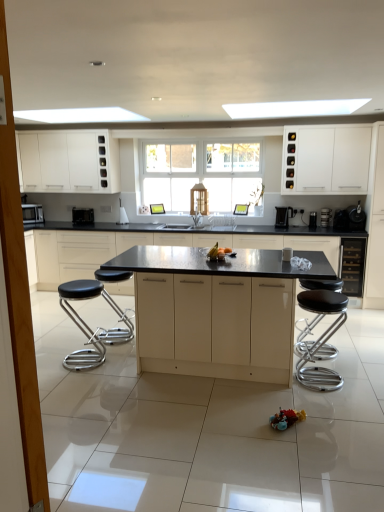
Question: From a real-world perspective, is matte black countertop at center, the fourth cabinetry positioned from the front, physically above black plastic coffee machine at right, placed as the second coffee machine when sorted from left to right?

Choices:
 (A) yes
 (B) no

Answer: (B)

Question: From the image's perspective, is matte black countertop at center, which is the third cabinetry from back to front, located beneath black plastic coffee machine at right, placed as the second coffee machine when sorted from left to right?

Choices:
 (A) no
 (B) yes

Answer: (B)

Question: Does matte black countertop at center, which is the third cabinetry from back to front, have a greater height compared to black plastic coffee machine at right, the first coffee machine viewed from the right?

Choices:
 (A) no
 (B) yes

Answer: (B)

Question: Considering the relative positions of matte black countertop at center, the fourth cabinetry positioned from the front, and black plastic coffee machine at right, the first coffee machine viewed from the right, in the image provided, is matte black countertop at center, the fourth cabinetry positioned from the front, in front of black plastic coffee machine at right, the first coffee machine viewed from the right,?

Choices:
 (A) yes
 (B) no

Answer: (A)

Question: Does matte black countertop at center, which is the third cabinetry from back to front, have a smaller size compared to black plastic coffee machine at right, the first coffee machine viewed from the right?

Choices:
 (A) yes
 (B) no

Answer: (B)

Question: Is black plastic coffee machine at center, arranged as the 2th coffee machine when viewed from the right, taller or shorter than black glass wine cooler at right, which is the second cabinetry from back to front?

Choices:
 (A) short
 (B) tall

Answer: (A)

Question: From the image's perspective, is black plastic coffee machine at center, arranged as the 2th coffee machine when viewed from the right, positioned above or below black glass wine cooler at right, which is the second cabinetry from back to front?

Choices:
 (A) below
 (B) above

Answer: (B)

Question: Looking at their shapes, would you say black plastic coffee machine at center, the 1th coffee machine in the left-to-right sequence, is wider or thinner than black glass wine cooler at right, the fifth cabinetry from the front?

Choices:
 (A) thin
 (B) wide

Answer: (A)

Question: From a real-world perspective, relative to black glass wine cooler at right, the fifth cabinetry from the front, is black plastic coffee machine at center, arranged as the 2th coffee machine when viewed from the right, vertically above or below?

Choices:
 (A) above
 (B) below

Answer: (A)

Question: In the image, is black leather stool at left, marked as the first bar stool in a left-to-right arrangement, positioned in front of or behind white matte cabinet at upper right, the fourth cabinetry from the back?

Choices:
 (A) behind
 (B) front

Answer: (B)

Question: Would you say black leather stool at left, acting as the 2th bar stool starting from the right, is inside or outside white matte cabinet at upper right, the fourth cabinetry from the back?

Choices:
 (A) inside
 (B) outside

Answer: (B)

Question: Is black leather stool at left, marked as the first bar stool in a left-to-right arrangement, to the left or to the right of white matte cabinet at upper right, acting as the third cabinetry starting from the front, in the image?

Choices:
 (A) right
 (B) left

Answer: (B)

Question: From a real-world perspective, relative to white matte cabinet at upper right, the fourth cabinetry from the back, is black leather stool at left, acting as the 2th bar stool starting from the right, vertically above or below?

Choices:
 (A) above
 (B) below

Answer: (B)

Question: From the image's perspective, is black plastic coffee maker at center right, which is the 3th appliance in left-to-right order, above or below white matte cabinet at upper right, the fourth cabinetry from the back?

Choices:
 (A) above
 (B) below

Answer: (B)

Question: Is black plastic coffee maker at center right, marked as the third appliance in a right-to-left arrangement, to the left or to the right of white matte cabinet at upper right, the fourth cabinetry from the back, in the image?

Choices:
 (A) left
 (B) right

Answer: (A)